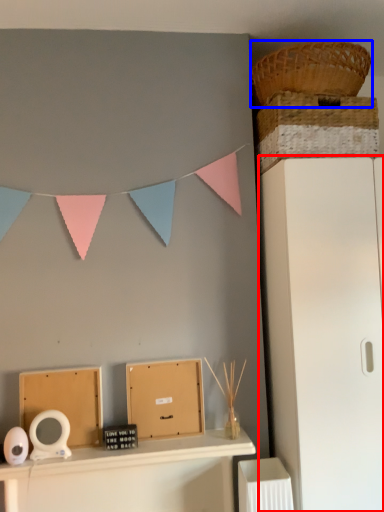
Question: Which of the following is the farthest to the observer, file cabinet (highlighted by a red box) or basket (highlighted by a blue box)?

Choices:
 (A) file cabinet
 (B) basket

Answer: (B)